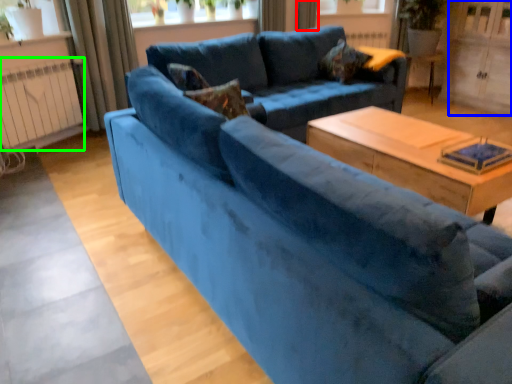
Question: Based on their relative distances, which object is farther from curtain (highlighted by a red box)? Choose from screen door (highlighted by a blue box) and radiator (highlighted by a green box).

Choices:
 (A) screen door
 (B) radiator

Answer: (B)